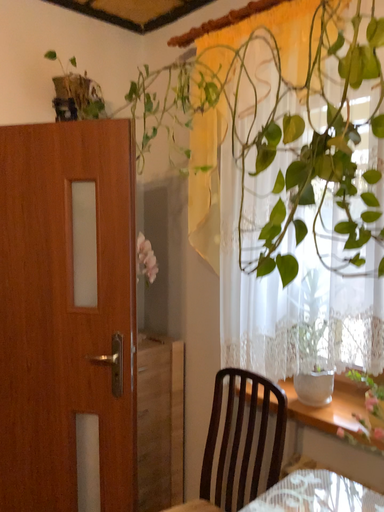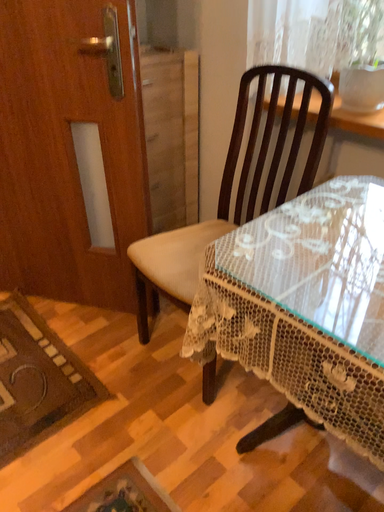
Question: Which way did the camera rotate in the video?

Choices:
 (A) rotated upward
 (B) rotated downward

Answer: (B)